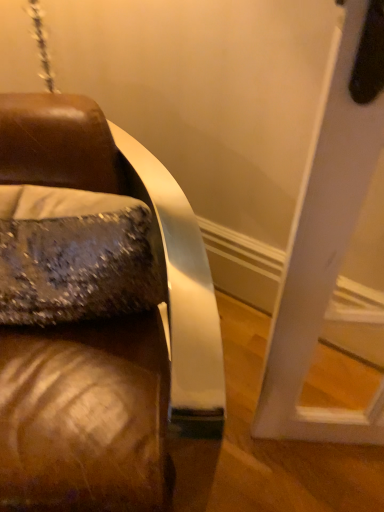
Question: Could you tell me if sparkly silver pillow at left is turned towards brown leather couch at left?

Choices:
 (A) yes
 (B) no

Answer: (A)

Question: Does sparkly silver pillow at left have a greater height compared to brown leather couch at left?

Choices:
 (A) yes
 (B) no

Answer: (B)

Question: From a real-world perspective, does sparkly silver pillow at left stand above brown leather couch at left?

Choices:
 (A) yes
 (B) no

Answer: (A)

Question: Is the position of sparkly silver pillow at left more distant than that of brown leather couch at left?

Choices:
 (A) no
 (B) yes

Answer: (B)

Question: Is sparkly silver pillow at left facing away from brown leather couch at left?

Choices:
 (A) yes
 (B) no

Answer: (A)

Question: From the image's perspective, is sparkly silver pillow at left on top of brown leather couch at left?

Choices:
 (A) no
 (B) yes

Answer: (B)

Question: Can you confirm if brown leather couch at left is bigger than sparkly silver pillow at left?

Choices:
 (A) yes
 (B) no

Answer: (A)

Question: Is brown leather couch at left to the left of sparkly silver pillow at left from the viewer's perspective?

Choices:
 (A) yes
 (B) no

Answer: (A)

Question: Can you confirm if brown leather couch at left is thinner than sparkly silver pillow at left?

Choices:
 (A) no
 (B) yes

Answer: (A)

Question: Does brown leather couch at left lie in front of sparkly silver pillow at left?

Choices:
 (A) no
 (B) yes

Answer: (B)

Question: Would you say brown leather couch at left is outside sparkly silver pillow at left?

Choices:
 (A) no
 (B) yes

Answer: (B)

Question: Is brown leather couch at left at the right side of sparkly silver pillow at left?

Choices:
 (A) yes
 (B) no

Answer: (B)

Question: Looking at the image, does brown leather couch at left seem bigger or smaller compared to sparkly silver pillow at left?

Choices:
 (A) big
 (B) small

Answer: (A)